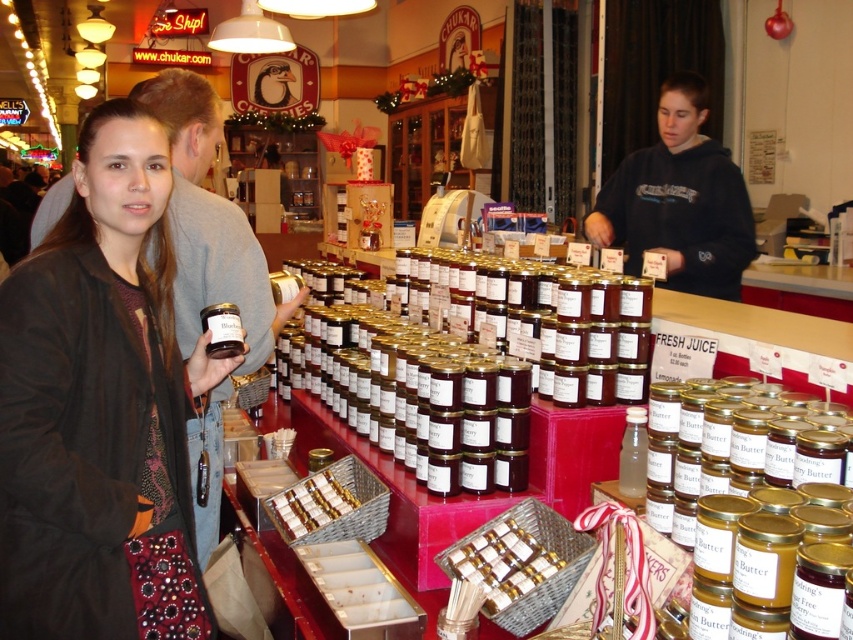
Question: Is matte black jacket at left to the left of black hoodie at center from the viewer's perspective?

Choices:
 (A) no
 (B) yes

Answer: (B)

Question: Which point is closer to the camera taking this photo?

Choices:
 (A) (155, 545)
 (B) (746, 243)

Answer: (A)

Question: Does black hoodie at center have a larger size compared to shiny chocolate bar at center?

Choices:
 (A) no
 (B) yes

Answer: (B)

Question: Which point is closer to the camera?

Choices:
 (A) (668, 236)
 (B) (183, 620)
 (C) (323, 522)

Answer: (B)

Question: Can you confirm if matte black jacket at left is positioned to the right of black hoodie at center?

Choices:
 (A) no
 (B) yes

Answer: (A)

Question: Which of the following is the farthest from the observer?

Choices:
 (A) (341, 509)
 (B) (9, 518)

Answer: (A)